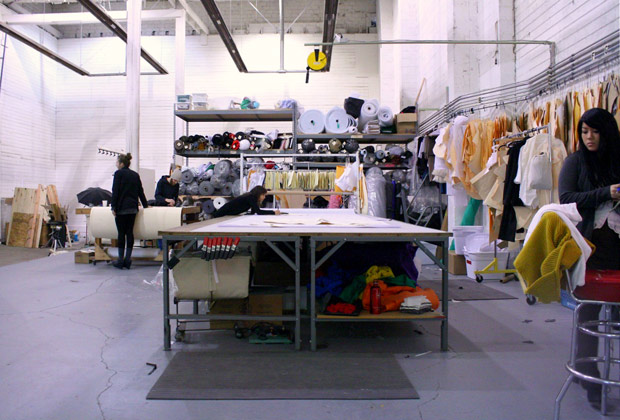
Locate an element on the screen. This screenshot has width=620, height=420. grey floor is located at coordinates (440, 381).